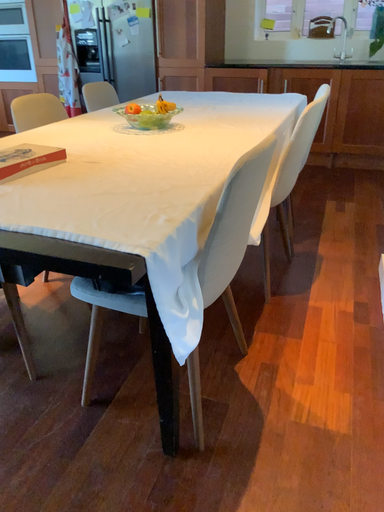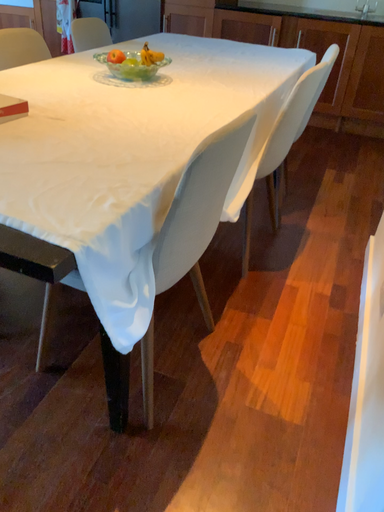
Question: How did the camera likely rotate when shooting the video?

Choices:
 (A) rotated downward
 (B) rotated upward

Answer: (A)